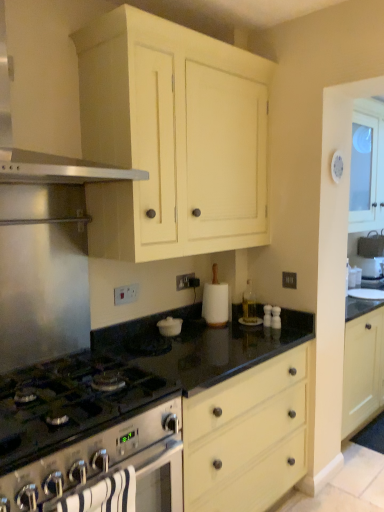
Question: Is satin silver range hood at upper left far away from black granite countertop at center?

Choices:
 (A) yes
 (B) no

Answer: (A)

Question: From the image's perspective, is satin silver range hood at upper left located beneath black granite countertop at center?

Choices:
 (A) no
 (B) yes

Answer: (A)

Question: Is satin silver range hood at upper left at the left side of black granite countertop at center?

Choices:
 (A) no
 (B) yes

Answer: (B)

Question: Could you tell me if satin silver range hood at upper left is turned towards black granite countertop at center?

Choices:
 (A) yes
 (B) no

Answer: (B)

Question: Is satin silver range hood at upper left further to camera compared to black granite countertop at center?

Choices:
 (A) no
 (B) yes

Answer: (A)

Question: Is point (246, 306) positioned closer to the camera than point (107, 462)?

Choices:
 (A) farther
 (B) closer

Answer: (A)

Question: Looking at their shapes, would you say clear glass bottle at center is wider or thinner than satin silver oven at lower left?

Choices:
 (A) thin
 (B) wide

Answer: (A)

Question: Is clear glass bottle at center in front of or behind satin silver oven at lower left in the image?

Choices:
 (A) behind
 (B) front

Answer: (A)

Question: Considering the relative positions of clear glass bottle at center and satin silver oven at lower left in the image provided, is clear glass bottle at center to the left or to the right of satin silver oven at lower left?

Choices:
 (A) right
 (B) left

Answer: (A)

Question: From the image's perspective, is black granite countertop at center located above or below satin silver range hood at upper left?

Choices:
 (A) below
 (B) above

Answer: (A)

Question: Based on their sizes in the image, would you say black granite countertop at center is bigger or smaller than satin silver range hood at upper left?

Choices:
 (A) small
 (B) big

Answer: (B)

Question: Do you think black granite countertop at center is within satin silver range hood at upper left, or outside of it?

Choices:
 (A) inside
 (B) outside

Answer: (B)

Question: Is black granite countertop at center wider or thinner than satin silver range hood at upper left?

Choices:
 (A) wide
 (B) thin

Answer: (A)

Question: Choose the correct answer: Is satin silver range hood at upper left inside satin silver gas stove at lower left or outside it?

Choices:
 (A) inside
 (B) outside

Answer: (B)

Question: Relative to satin silver gas stove at lower left, is satin silver range hood at upper left in front or behind?

Choices:
 (A) behind
 (B) front

Answer: (B)